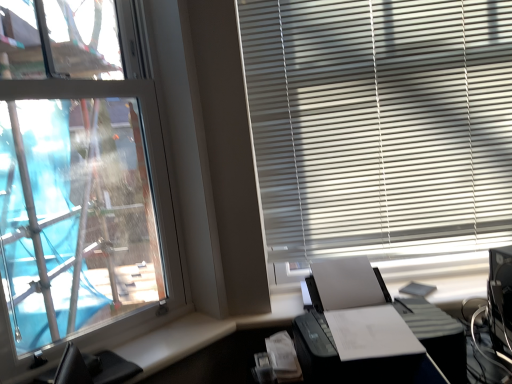
Question: From a real-world perspective, is black leather computer chair at lower left positioned over white matte blinds at upper right based on gravity?

Choices:
 (A) yes
 (B) no

Answer: (B)

Question: Is black leather computer chair at lower left touching white matte blinds at upper right?

Choices:
 (A) no
 (B) yes

Answer: (A)

Question: Can you confirm if black leather computer chair at lower left is positioned to the right of white matte blinds at upper right?

Choices:
 (A) yes
 (B) no

Answer: (B)

Question: Is black leather computer chair at lower left outside white matte blinds at upper right?

Choices:
 (A) no
 (B) yes

Answer: (B)

Question: Is the position of black leather computer chair at lower left less distant than that of white matte blinds at upper right?

Choices:
 (A) yes
 (B) no

Answer: (A)

Question: Can you confirm if black leather computer chair at lower left is taller than white matte blinds at upper right?

Choices:
 (A) no
 (B) yes

Answer: (A)

Question: Is black plastic printer at lower right wider than black leather computer chair at lower left?

Choices:
 (A) yes
 (B) no

Answer: (A)

Question: Is black plastic printer at lower right oriented away from black leather computer chair at lower left?

Choices:
 (A) no
 (B) yes

Answer: (A)

Question: From a real-world perspective, is black plastic printer at lower right positioned under black leather computer chair at lower left based on gravity?

Choices:
 (A) no
 (B) yes

Answer: (A)

Question: Is black plastic printer at lower right thinner than black leather computer chair at lower left?

Choices:
 (A) no
 (B) yes

Answer: (A)

Question: Does black plastic printer at lower right have a lesser height compared to black leather computer chair at lower left?

Choices:
 (A) yes
 (B) no

Answer: (B)

Question: From a real-world perspective, is black plastic printer at lower right on top of black leather computer chair at lower left?

Choices:
 (A) yes
 (B) no

Answer: (A)

Question: Is white matte blinds at upper right outside of black plastic printer at lower right?

Choices:
 (A) no
 (B) yes

Answer: (B)